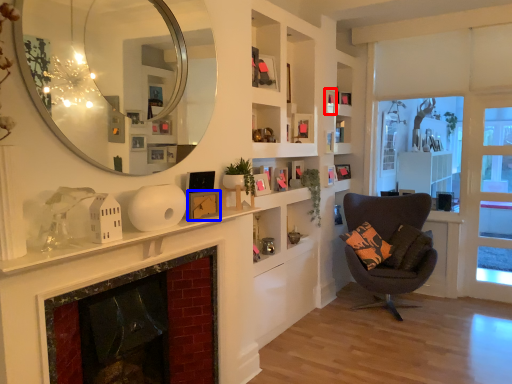
Question: Which object is further to the camera taking this photo, picture frame (highlighted by a red box) or picture frame (highlighted by a blue box)?

Choices:
 (A) picture frame
 (B) picture frame

Answer: (A)